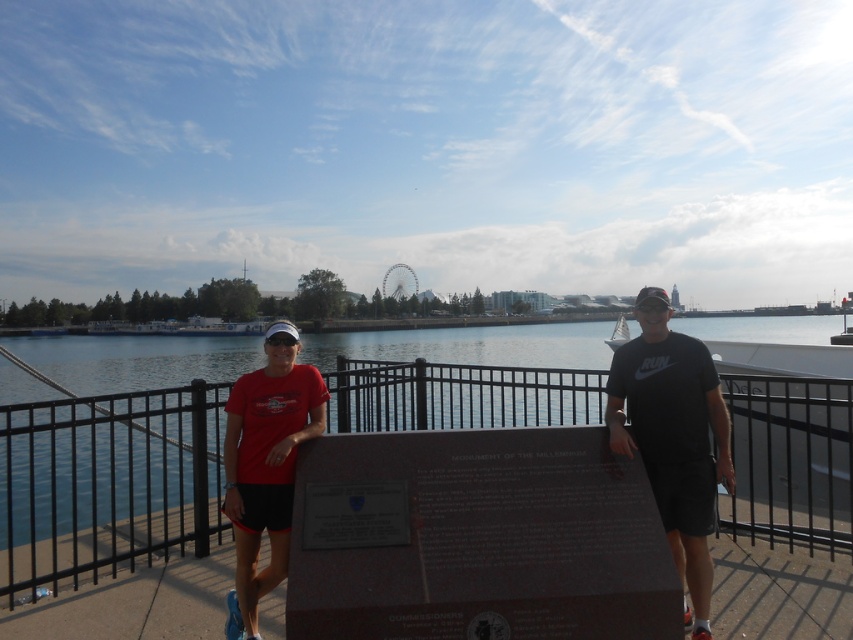
Which of these two, black metal fence at center or matte red shirt at center, stands taller?

With more height is black metal fence at center.

Does point (61, 556) lie in front of point (299, 388)?

No.

Find the location of a particular element. This screenshot has height=640, width=853. black metal fence at center is located at coordinates (106, 483).

Does black matte t-shirt at center have a lesser width compared to matte red shirt at center?

In fact, black matte t-shirt at center might be wider than matte red shirt at center.

Which is below, black matte t-shirt at center or matte red shirt at center?

Positioned lower is matte red shirt at center.

Locate an element on the screen. The height and width of the screenshot is (640, 853). black matte t-shirt at center is located at coordinates (672, 436).

Identify the location of black matte t-shirt at center. coord(672,436).

Is black metal fence at center positioned before black matte t-shirt at center?

No.

Which is behind, point (769, 515) or point (695, 456)?

Positioned behind is point (769, 515).

Does point (555, 390) come closer to viewer compared to point (613, 448)?

No, it is behind (613, 448).

Locate an element on the screen. black metal fence at center is located at coordinates (106, 483).